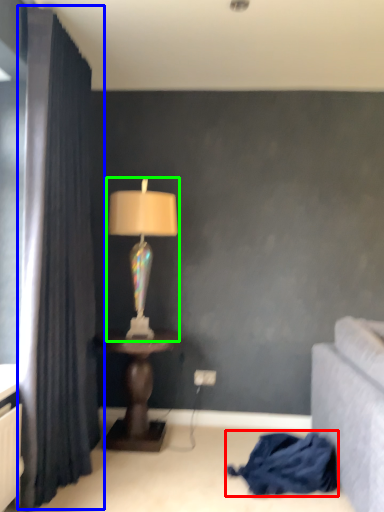
Question: Estimate the real-world distances between objects in this image. Which object is farther from blanket (highlighted by a red box), curtain (highlighted by a blue box) or lamp (highlighted by a green box)?

Choices:
 (A) curtain
 (B) lamp

Answer: (A)